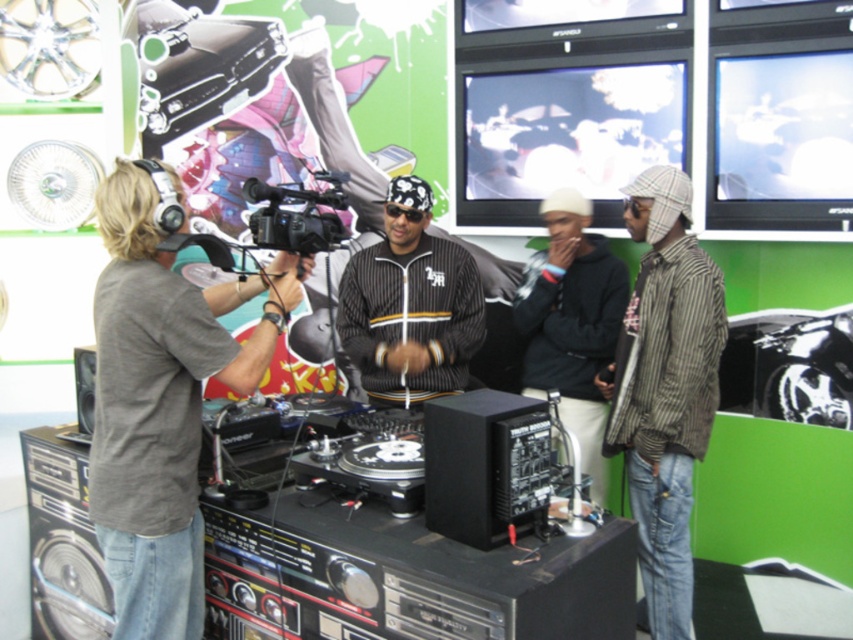
Looking at this image, who is lower down, striped cotton shirt at right or black plastic video camera at center?

striped cotton shirt at right is lower down.

Is point (625, 204) less distant than point (339, 224)?

No, it is not.

Locate an element on the screen. The width and height of the screenshot is (853, 640). striped cotton shirt at right is located at coordinates [x=664, y=387].

What do you see at coordinates (664, 387) in the screenshot? The image size is (853, 640). I see `striped cotton shirt at right` at bounding box center [664, 387].

Does striped cotton shirt at right have a lesser width compared to black matte hoodie at center?

Correct, striped cotton shirt at right's width is less than black matte hoodie at center's.

Who is more forward, (616, 433) or (577, 429)?

Positioned in front is point (616, 433).

You are a GUI agent. You are given a task and a screenshot of the screen. Output one action in this format:
    pyautogui.click(x=<x>, y=<y>)
    Task: Click on the striped cotton shirt at right
    The height and width of the screenshot is (640, 853).
    Given the screenshot: What is the action you would take?
    pyautogui.click(x=664, y=387)

Between striped cotton shirt at right and black pinstripe jacket at center, which one has less height?

With less height is black pinstripe jacket at center.

Is point (689, 481) closer to viewer compared to point (392, 396)?

Yes.

Image resolution: width=853 pixels, height=640 pixels. What are the coordinates of `striped cotton shirt at right` in the screenshot? It's located at (664, 387).